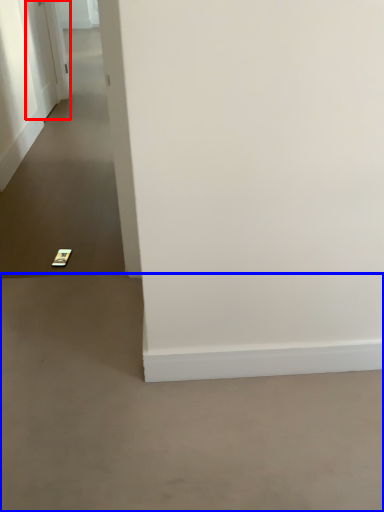
Question: Which of the following is the closest to the observer, door (highlighted by a red box) or concrete (highlighted by a blue box)?

Choices:
 (A) door
 (B) concrete

Answer: (B)